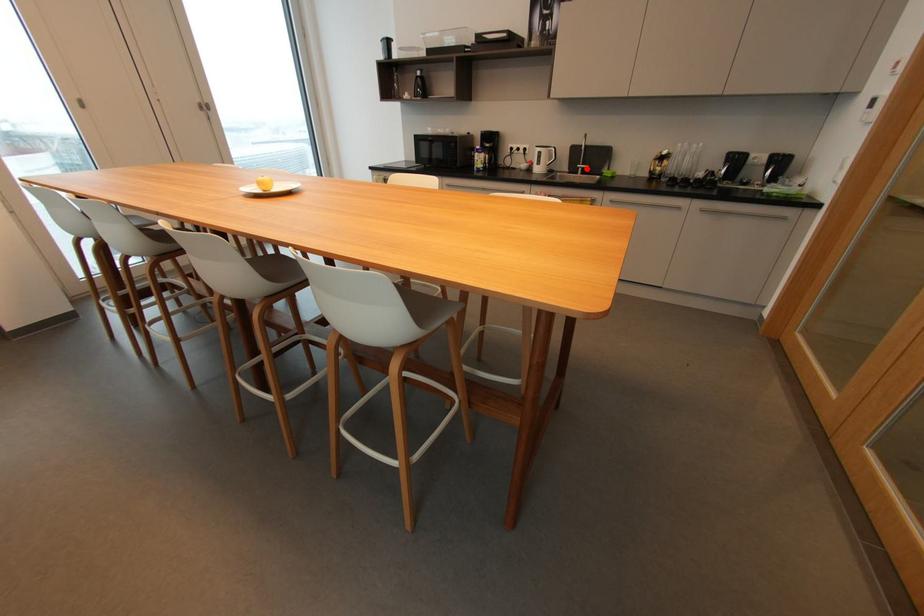
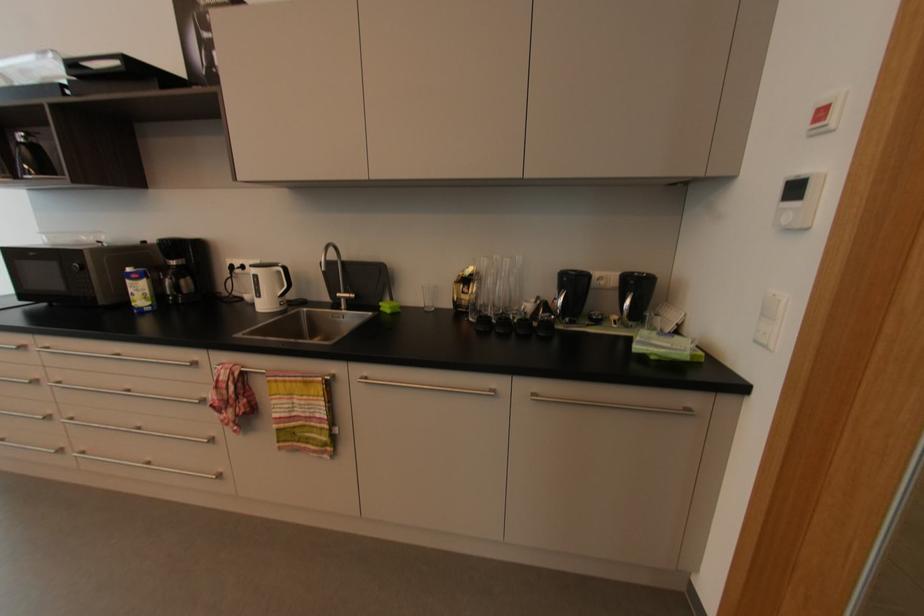
Where in the second image is the point corresponding to the highlighted location from the first image?

(350, 300)